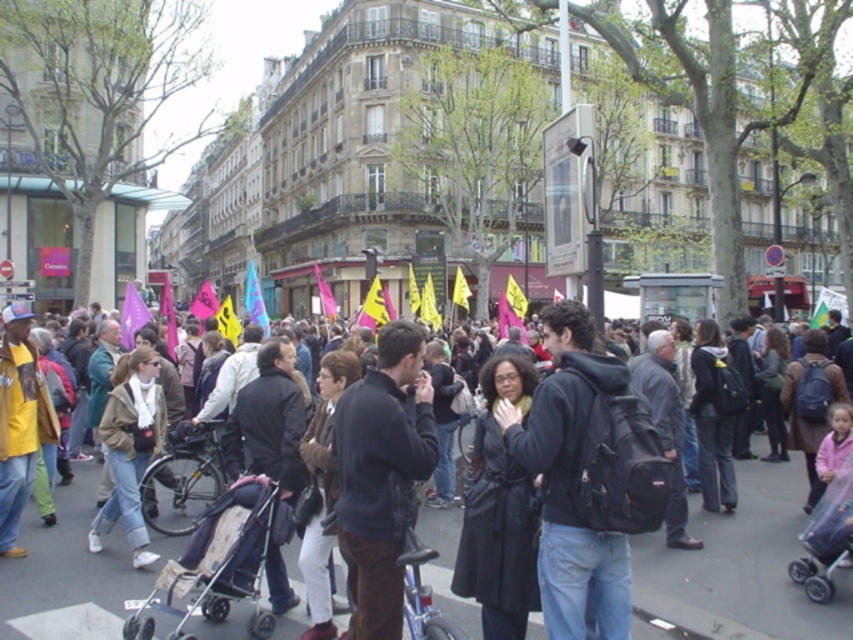
Does light brown leather jacket at center have a greater width compared to transparent plastic baby carriage at lower right?

Indeed, light brown leather jacket at center has a greater width compared to transparent plastic baby carriage at lower right.

Where is `light brown leather jacket at center`? Image resolution: width=853 pixels, height=640 pixels. light brown leather jacket at center is located at coordinates (131, 449).

Is point (134, 540) behind point (807, 541)?

Yes, point (134, 540) is behind point (807, 541).

In order to click on light brown leather jacket at center in this screenshot , I will do `click(131, 449)`.

Which is more to the right, beige fabric stroller at lower left or light brown leather jacket at center?

Positioned to the right is beige fabric stroller at lower left.

Does point (227, 609) come farther from viewer compared to point (111, 493)?

No, (227, 609) is in front of (111, 493).

Locate an element on the screen. The height and width of the screenshot is (640, 853). beige fabric stroller at lower left is located at coordinates (221, 561).

Is point (686, 624) in front of point (103, 525)?

Yes, it is.

Is point (792, 480) behind point (149, 416)?

Yes, it is behind point (149, 416).

Locate an element on the screen. The height and width of the screenshot is (640, 853). dark gray asphalt at center is located at coordinates (741, 564).